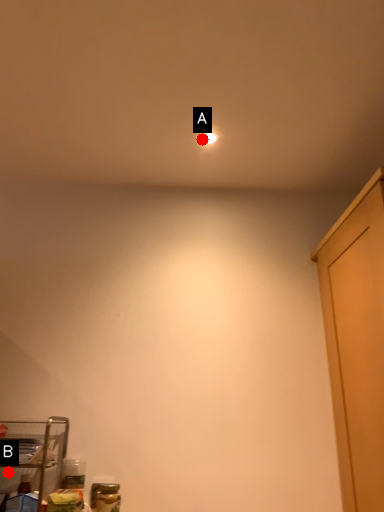
Question: Two points are circled on the image, labeled by A and B beside each circle. Which point appears farthest from the camera in this image?

Choices:
 (A) A is further
 (B) B is further

Answer: (A)